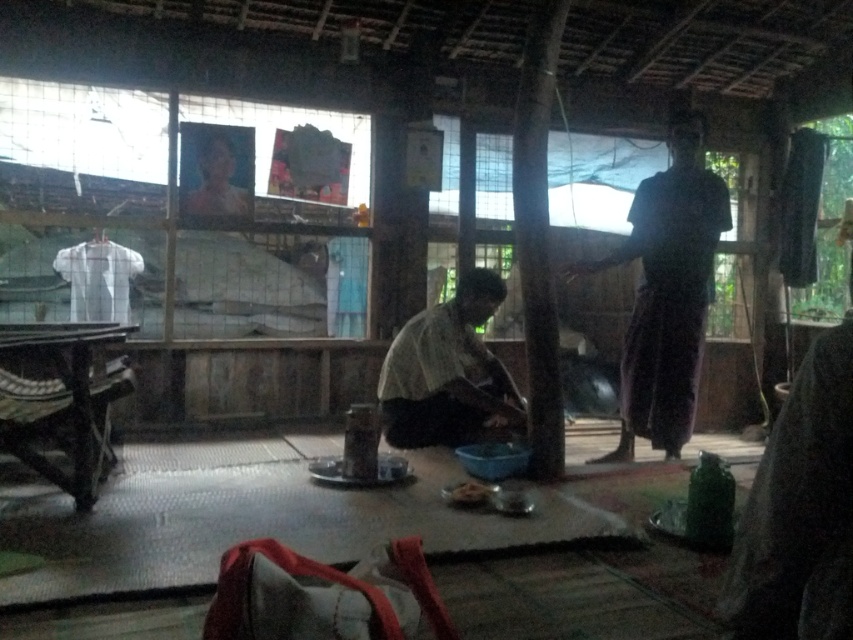
Which is more to the left, dark brown fabric at right or matte white shirt at center?

From the viewer's perspective, matte white shirt at center appears more on the left side.

Is dark brown fabric at right behind matte white shirt at center?

Yes.

Does point (718, 209) lie behind point (386, 360)?

Yes.

Identify the location of dark brown fabric at right. The height and width of the screenshot is (640, 853). (666, 291).